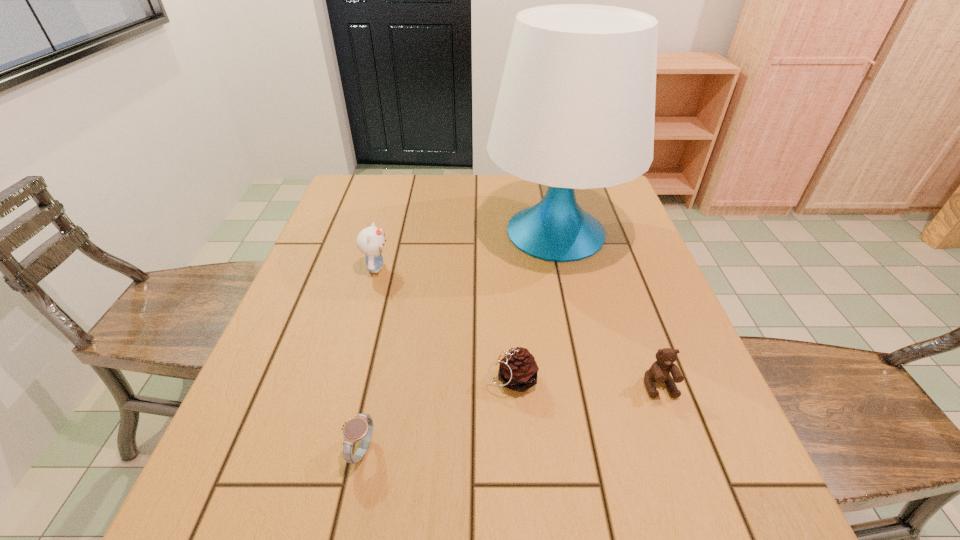
The image size is (960, 540). What are the coordinates of `table lamp` in the screenshot? It's located at (576, 107).

Where is `the leftmost object`? This screenshot has height=540, width=960. the leftmost object is located at coordinates (370, 241).

The width and height of the screenshot is (960, 540). What are the coordinates of `kitten` in the screenshot? It's located at (x=370, y=241).

Locate an element on the screen. teddy bear is located at coordinates (659, 372).

Locate an element on the screen. pinecone is located at coordinates (518, 369).

Image resolution: width=960 pixels, height=540 pixels. In order to click on watch in this screenshot , I will do `click(360, 427)`.

This screenshot has width=960, height=540. Identify the location of the nearest object. (360, 427).

Locate an element on the screen. Image resolution: width=960 pixels, height=540 pixels. vacant space located 0.320m on the front-facing side of the table lamp is located at coordinates (592, 388).

At what (x,y) coordinates should I click in order to perform the action: click on free spot located 0.250m on the front-facing side of the leftmost object. Please return your answer as a coordinate pair (x, y). The height and width of the screenshot is (540, 960). Looking at the image, I should click on (488, 268).

Where is `blank space located 0.210m on the face of the teddy bear`? blank space located 0.210m on the face of the teddy bear is located at coordinates (707, 517).